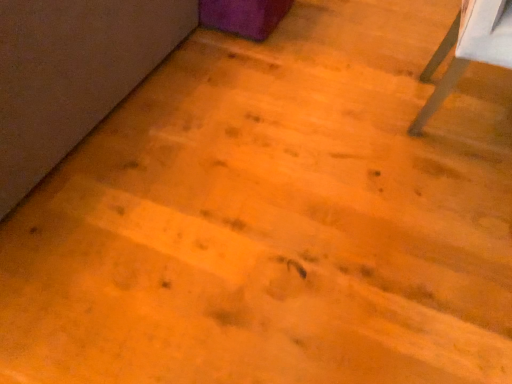
Question: Should I look upward or downward to see wooden table at right?

Choices:
 (A) up
 (B) down

Answer: (A)